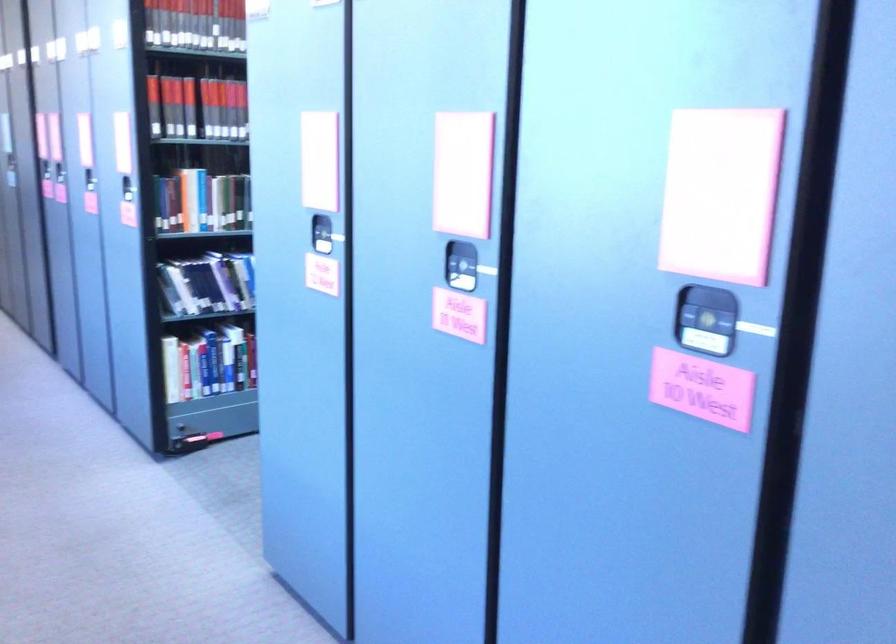
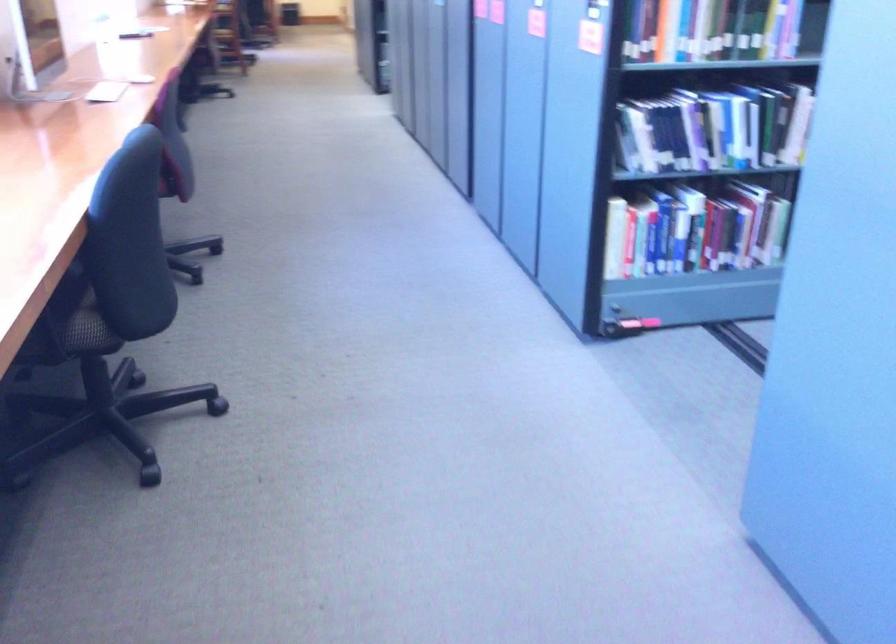
Where in the second image is the point corresponding to point 188,438 from the first image?

(625, 325)